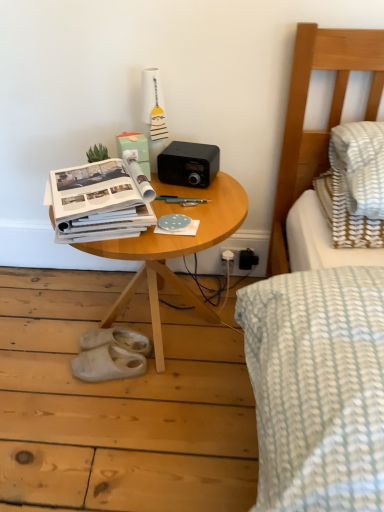
This screenshot has width=384, height=512. What do you see at coordinates (108, 364) in the screenshot? I see `white rubber slippers at lower left, the second footwear when ordered from back to front` at bounding box center [108, 364].

Measure the distance between white rubber slippers at lower left, the second footwear when ordered from back to front, and camera.

The distance of white rubber slippers at lower left, the second footwear when ordered from back to front, from camera is 1.38 meters.

At what (x,y) coordinates should I click in order to perform the action: click on white paper at center. Please return your answer as a coordinate pair (x, y). Looking at the image, I should click on (101, 201).

Image resolution: width=384 pixels, height=512 pixels. Identify the location of wooden table at center. (174, 249).

Does white paper at center have a greater height compared to white rubber slippers at lower left, the second footwear when ordered from back to front?

Indeed, white paper at center has a greater height compared to white rubber slippers at lower left, the second footwear when ordered from back to front.

From the image's perspective, would you say white paper at center is positioned over white rubber slippers at lower left, the 1th footwear in the front-to-back sequence?

Yes, from the image's perspective, white paper at center is on top of white rubber slippers at lower left, the 1th footwear in the front-to-back sequence.

Does point (101, 198) come behind point (101, 379)?

No, (101, 198) is in front of (101, 379).

Looking at this image, is white paper at center bigger than white rubber slippers at lower left, the second footwear when ordered from back to front?

Yes, white paper at center is bigger than white rubber slippers at lower left, the second footwear when ordered from back to front.

Is white paper at center positioned with its back to white rubber sandals at lower left, acting as the first footwear starting from the back?

white paper at center does not have its back to white rubber sandals at lower left, acting as the first footwear starting from the back.

Considering the points (62, 236) and (101, 337), which point is behind, point (62, 236) or point (101, 337)?

Point (101, 337)

Considering the sizes of objects white paper at center and white rubber sandals at lower left, acting as the first footwear starting from the back, in the image provided, who is thinner, white paper at center or white rubber sandals at lower left, acting as the first footwear starting from the back,?

white rubber sandals at lower left, acting as the first footwear starting from the back.

Between white paper at center and white rubber sandals at lower left, acting as the first footwear starting from the back, which one appears on the left side from the viewer's perspective?

From the viewer's perspective, white rubber sandals at lower left, acting as the first footwear starting from the back, appears more on the left side.

Is white paper at center not near wooden table at center?

No, there isn't a large distance between white paper at center and wooden table at center.

From a real-world perspective, relative to wooden table at center, is white paper at center vertically above or below?

Clearly, from a real-world perspective, white paper at center is above wooden table at center.

Is white paper at center shorter than wooden table at center?

Correct, white paper at center is not as tall as wooden table at center.

Between white rubber slippers at lower left, the second footwear when ordered from back to front, and white paper at center, which one has smaller size?

With smaller size is white rubber slippers at lower left, the second footwear when ordered from back to front.

Between white rubber slippers at lower left, the 1th footwear in the front-to-back sequence, and white paper at center, which one is positioned in front?

Positioned in front is white paper at center.

From the image's perspective, is white rubber slippers at lower left, the 1th footwear in the front-to-back sequence, under white paper at center?

Yes, from the image's perspective, white rubber slippers at lower left, the 1th footwear in the front-to-back sequence, is below white paper at center.

Which object is positioned more to the left, white rubber slippers at lower left, the 1th footwear in the front-to-back sequence, or white paper at center?

white rubber slippers at lower left, the 1th footwear in the front-to-back sequence, is more to the left.

Considering the sizes of white rubber sandals at lower left, acting as the first footwear starting from the back, and wooden table at center in the image, is white rubber sandals at lower left, acting as the first footwear starting from the back, taller or shorter than wooden table at center?

white rubber sandals at lower left, acting as the first footwear starting from the back, is shorter than wooden table at center.

Looking at this image, does white rubber sandals at lower left, acting as the first footwear starting from the back, have a larger size compared to wooden table at center?

No, white rubber sandals at lower left, acting as the first footwear starting from the back, is not bigger than wooden table at center.

Where is `table located above the white rubber sandals at lower left, acting as the first footwear starting from the back (from the image's perspective)`? table located above the white rubber sandals at lower left, acting as the first footwear starting from the back (from the image's perspective) is located at coordinates (174, 249).

Based on the photo, is white rubber sandals at lower left, the second footwear in the front-to-back sequence, inside the boundaries of wooden table at center, or outside?

white rubber sandals at lower left, the second footwear in the front-to-back sequence, exists entirely within wooden table at center.

Is white rubber slippers at lower left, the second footwear when ordered from back to front, far from wooden table at center?

They are positioned close to each other.

At what (x,y) coordinates should I click in order to perform the action: click on the 2nd footwear located beneath the wooden table at center (from a real-world perspective). Please return your answer as a coordinate pair (x, y). Looking at the image, I should click on (108, 364).

From the image's perspective, which one is positioned lower, white rubber slippers at lower left, the 1th footwear in the front-to-back sequence, or wooden table at center?

white rubber slippers at lower left, the 1th footwear in the front-to-back sequence, is shown below in the image.

Is white rubber slippers at lower left, the second footwear when ordered from back to front, in front of or behind wooden table at center in the image?

In the image, white rubber slippers at lower left, the second footwear when ordered from back to front, appears behind wooden table at center.

Between white rubber sandals at lower left, the second footwear in the front-to-back sequence, and white paper at center, which one has smaller size?

white rubber sandals at lower left, the second footwear in the front-to-back sequence.

From the image's perspective, which one is positioned lower, white rubber sandals at lower left, acting as the first footwear starting from the back, or white paper at center?

white rubber sandals at lower left, acting as the first footwear starting from the back, from the image's perspective.

Can you confirm if white rubber sandals at lower left, acting as the first footwear starting from the back, is wider than white paper at center?

No.

Considering the positions of point (128, 334) and point (68, 191), is point (128, 334) closer or farther from the camera than point (68, 191)?

Point (128, 334) is positioned farther from the camera compared to point (68, 191).

Find the location of `the 2nd footwear below the white paper at center (from the image's perspective)`. the 2nd footwear below the white paper at center (from the image's perspective) is located at coordinates (108, 364).

This screenshot has height=512, width=384. I want to click on paperback book above the white rubber sandals at lower left, acting as the first footwear starting from the back (from a real-world perspective), so click(101, 201).

Which object lies nearer to the anchor point white rubber slippers at lower left, the second footwear when ordered from back to front, white rubber sandals at lower left, acting as the first footwear starting from the back, or wooden table at center?

white rubber sandals at lower left, acting as the first footwear starting from the back.

From the picture: Which object lies further to the anchor point white rubber slippers at lower left, the second footwear when ordered from back to front, wooden table at center or white paper at center?

The object further to white rubber slippers at lower left, the second footwear when ordered from back to front, is white paper at center.

Based on the photo, looking at the image, which one is located closer to white rubber sandals at lower left, acting as the first footwear starting from the back, white paper at center or white rubber slippers at lower left, the second footwear when ordered from back to front?

white rubber slippers at lower left, the second footwear when ordered from back to front, is positioned closer to the anchor white rubber sandals at lower left, acting as the first footwear starting from the back.

Looking at the image, which one is located further to wooden table at center, white rubber slippers at lower left, the second footwear when ordered from back to front, or white rubber sandals at lower left, the second footwear in the front-to-back sequence?

The object further to wooden table at center is white rubber sandals at lower left, the second footwear in the front-to-back sequence.

From the image, which object appears to be farther from white paper at center, wooden table at center or white rubber slippers at lower left, the second footwear when ordered from back to front?

The object further to white paper at center is white rubber slippers at lower left, the second footwear when ordered from back to front.

Looking at the image, which one is located closer to white rubber sandals at lower left, the second footwear in the front-to-back sequence, wooden table at center or white paper at center?

Based on the image, wooden table at center appears to be nearer to white rubber sandals at lower left, the second footwear in the front-to-back sequence.

Considering their positions, is white rubber sandals at lower left, the second footwear in the front-to-back sequence, positioned further to wooden table at center than white rubber slippers at lower left, the 1th footwear in the front-to-back sequence?

The object further to wooden table at center is white rubber sandals at lower left, the second footwear in the front-to-back sequence.

From the image, which object appears to be nearer to white rubber slippers at lower left, the second footwear when ordered from back to front, white paper at center or white rubber sandals at lower left, acting as the first footwear starting from the back?

The object closer to white rubber slippers at lower left, the second footwear when ordered from back to front, is white rubber sandals at lower left, acting as the first footwear starting from the back.

Where is `table between white paper at center and white rubber sandals at lower left, the second footwear in the front-to-back sequence, vertically`? The width and height of the screenshot is (384, 512). table between white paper at center and white rubber sandals at lower left, the second footwear in the front-to-back sequence, vertically is located at coordinates (174, 249).

Locate an element on the screen. table between white paper at center and white rubber slippers at lower left, the second footwear when ordered from back to front, vertically is located at coordinates (174, 249).

At what (x,y) coordinates should I click in order to perform the action: click on footwear that lies between white paper at center and white rubber slippers at lower left, the 1th footwear in the front-to-back sequence, from top to bottom. Please return your answer as a coordinate pair (x, y). Looking at the image, I should click on (116, 340).

Locate an element on the screen. The width and height of the screenshot is (384, 512). footwear between wooden table at center and white rubber sandals at lower left, the second footwear in the front-to-back sequence, from front to back is located at coordinates (108, 364).